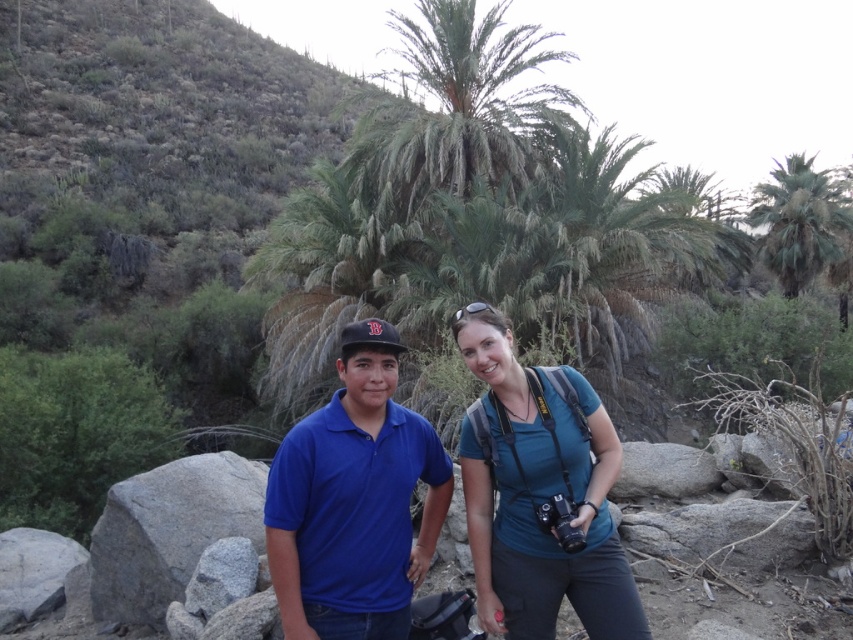
Question: Which point is closer to the camera?

Choices:
 (A) matte blue polo shirt at center
 (B) green leafy palm tree at upper right
 (C) blue cotton shirt at center

Answer: (A)

Question: Considering the relative positions of blue cotton shirt at center and gray granite rock at lower left in the image provided, where is blue cotton shirt at center located with respect to gray granite rock at lower left?

Choices:
 (A) above
 (B) below

Answer: (A)

Question: Considering the real-world distances, which object is farthest from the matte blue polo shirt at center?

Choices:
 (A) blue cotton shirt at center
 (B) gray granite rock at lower left
 (C) green leafy palm tree at upper right

Answer: (C)

Question: Is matte blue polo shirt at center wider than green leafy palm tree at upper right?

Choices:
 (A) yes
 (B) no

Answer: (B)

Question: Is blue cotton shirt at center smaller than gray granite rock at lower left?

Choices:
 (A) yes
 (B) no

Answer: (A)

Question: Which is farther from the blue cotton shirt at center?

Choices:
 (A) matte blue polo shirt at center
 (B) green leafy palm tree at upper right

Answer: (B)